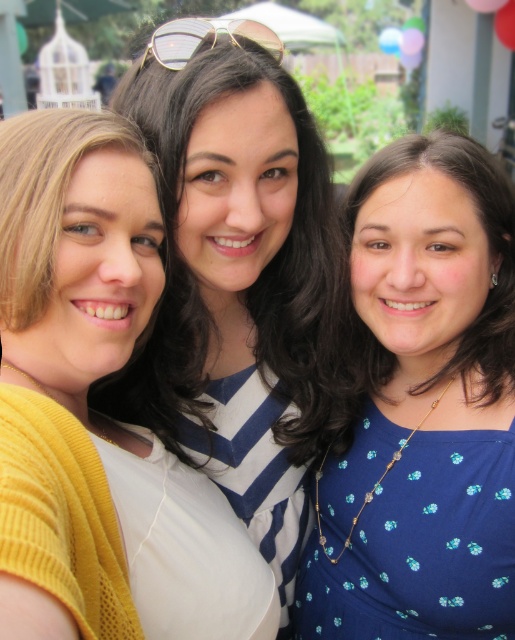
You are taking a photo of three people standing in a garden. You notice two white matte shirts among them. Which one is closer to you, the matte white shirt at center or the white matte shirt at center?

The matte white shirt at center is closer to you than the white matte shirt at center.

You are taking a selfie with two friends. You notice that the matte white shirt at center and the blue dotted dress at center are both visible in the frame. Based on their positions, which clothing item is closer to the left side of the photo?

The matte white shirt at center is positioned to the left of the blue dotted dress at center, so it is closer to the left side of the photo.

You are taking a photo of two friends wearing a matte white shirt at center and a blue dotted dress at center. Since you want to ensure both outfits are visible, which clothing item should you focus on to avoid cropping the edges?

The blue dotted dress at center has a greater width than the matte white shirt at center, so focusing on the blue dotted dress at center ensures both outfits are fully visible without cropping.